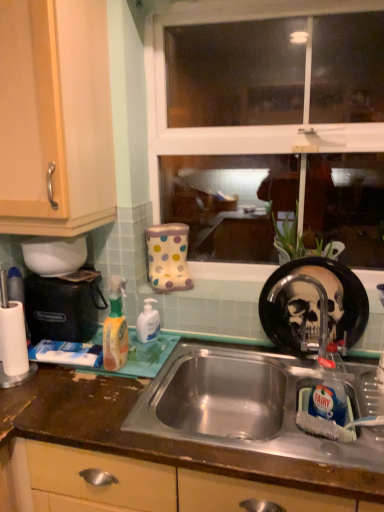
I want to click on free spot to the right of translucent orange spray bottle at left, marked as the first cleaning product in a left-to-right arrangement, so click(146, 362).